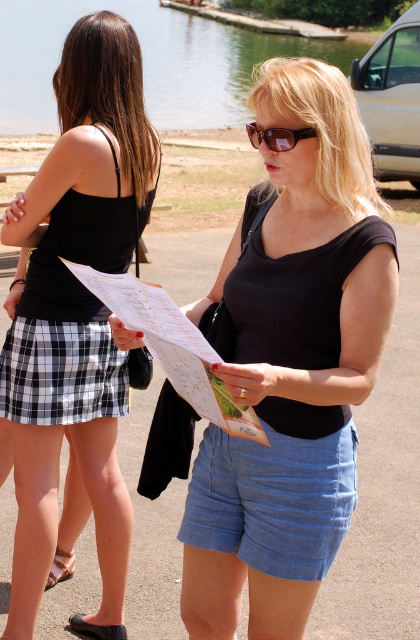
Describe the element at coordinates (291, 364) in the screenshot. I see `black matte shirt at center` at that location.

Who is shorter, black matte shirt at center or black plaid skirt at left?

With less height is black matte shirt at center.

At what (x,y) coordinates should I click in order to perform the action: click on black matte shirt at center. Please return your answer as a coordinate pair (x, y). This screenshot has height=640, width=420. Looking at the image, I should click on (291, 364).

Locate an element on the screen. black matte shirt at center is located at coordinates (291, 364).

Describe the element at coordinates (76, 314) in the screenshot. Image resolution: width=420 pixels, height=640 pixels. I see `black plaid skirt at left` at that location.

Can you confirm if black plaid skirt at left is taller than sunglasses at center?

Yes, black plaid skirt at left is taller than sunglasses at center.

Find the location of a particular element. black plaid skirt at left is located at coordinates (76, 314).

Locate an element on the screen. black plaid skirt at left is located at coordinates (76, 314).

Between point (21, 605) and point (257, 518), which one is positioned behind?

Point (21, 605)

Who is more forward, (x=47, y=348) or (x=325, y=540)?

Positioned in front is point (x=325, y=540).

You are a GUI agent. You are given a task and a screenshot of the screen. Output one action in this format:
    pyautogui.click(x=<x>, y=<y>)
    Task: Click on the black plaid skirt at left
    Image resolution: width=420 pixels, height=640 pixels.
    Given the screenshot: What is the action you would take?
    pyautogui.click(x=76, y=314)